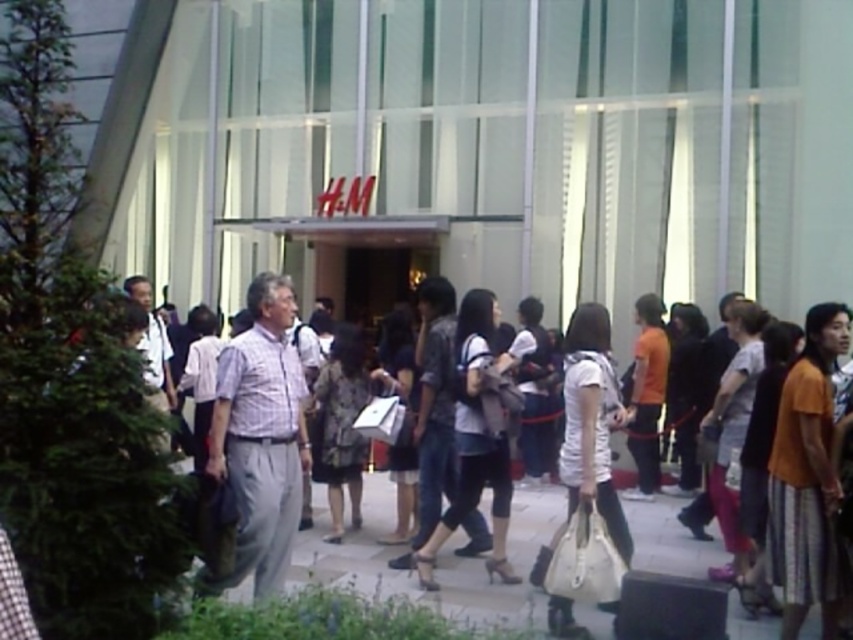
Can you confirm if leather beige handbag at lower center is positioned to the left of white shirt at center?

In fact, leather beige handbag at lower center is to the right of white shirt at center.

Does leather beige handbag at lower center have a greater width compared to white shirt at center?

In fact, leather beige handbag at lower center might be narrower than white shirt at center.

Locate an element on the screen. This screenshot has width=853, height=640. leather beige handbag at lower center is located at coordinates (585, 560).

Is light brown fabric shirt at center further to the viewer compared to white shirt at center?

No, it is not.

Between light brown fabric shirt at center and white shirt at center, which one has more height?

light brown fabric shirt at center is taller.

Identify the location of light brown fabric shirt at center. (260, 438).

Is point (374, 586) behind point (592, 572)?

Yes, it is.

In the scene shown: Measure the distance between point (x=289, y=589) and camera.

They are 4.91 meters apart.

Between point (462, 566) and point (608, 593), which one is positioned in front?

Point (608, 593)

Locate an element on the screen. smooth concrete pavement at center is located at coordinates (405, 570).